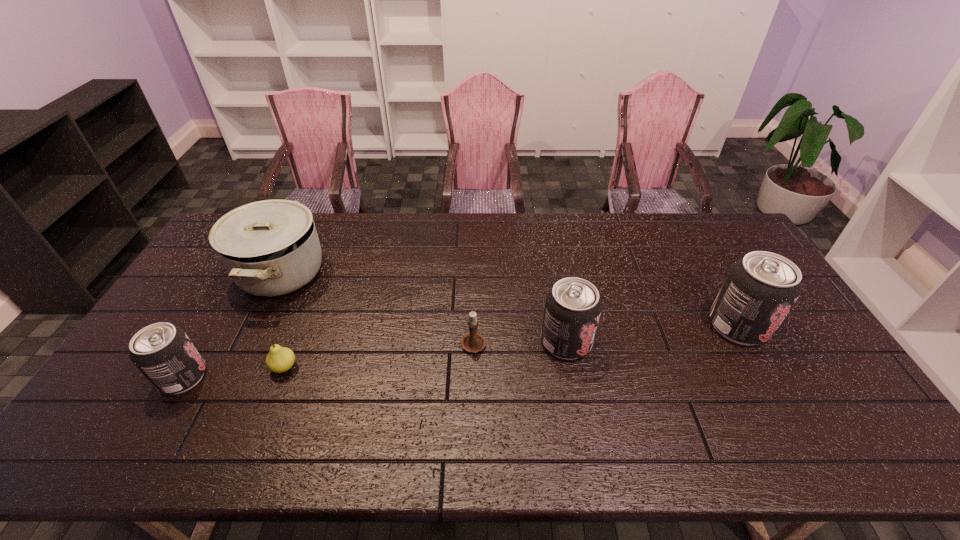
At what (x,y) coordinates should I click in order to perform the action: click on the leftmost soda can. Please return your answer as a coordinate pair (x, y). Looking at the image, I should click on click(163, 353).

This screenshot has width=960, height=540. I want to click on the third shortest object, so click(163, 353).

Locate an element on the screen. The width and height of the screenshot is (960, 540). the second tallest soda can is located at coordinates (573, 306).

The height and width of the screenshot is (540, 960). I want to click on the second object from right to left, so click(573, 306).

Identify the location of the rightmost soda can. This screenshot has width=960, height=540. (760, 289).

Where is `saucepan`? The image size is (960, 540). saucepan is located at coordinates (270, 248).

This screenshot has width=960, height=540. Identify the location of pear. (280, 359).

Find the location of a particular element. the fourth object from left to right is located at coordinates (472, 342).

The image size is (960, 540). I want to click on candle holder, so coord(472,342).

Identify the location of vacant region located 0.080m on the right of the shortest soda can. (236, 377).